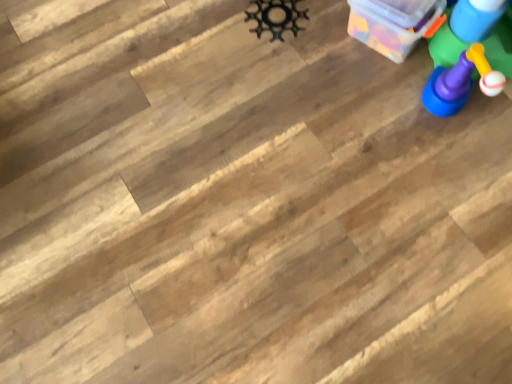
Question: Could you tell me if black metal gear at upper center, which is counted as the 1th toy, starting from the left, is facing transparent plastic container at upper right?

Choices:
 (A) yes
 (B) no

Answer: (B)

Question: Does black metal gear at upper center, the third toy from the right, appear on the left side of transparent plastic container at upper right?

Choices:
 (A) yes
 (B) no

Answer: (A)

Question: Is black metal gear at upper center, which is counted as the 1th toy, starting from the left, located outside transparent plastic container at upper right?

Choices:
 (A) no
 (B) yes

Answer: (B)

Question: From a real-world perspective, is black metal gear at upper center, the third toy from the right, located beneath transparent plastic container at upper right?

Choices:
 (A) no
 (B) yes

Answer: (B)

Question: Is black metal gear at upper center, the third toy from the right, directly adjacent to transparent plastic container at upper right?

Choices:
 (A) no
 (B) yes

Answer: (A)

Question: Is blue plastic toy at upper right, marked as the first toy in a right-to-left arrangement, wider or thinner than matte plastic toy at right, placed as the second toy when sorted from left to right?

Choices:
 (A) wide
 (B) thin

Answer: (B)

Question: From a real-world perspective, is blue plastic toy at upper right, marked as the first toy in a right-to-left arrangement, positioned above or below matte plastic toy at right, placed as the second toy when sorted from left to right?

Choices:
 (A) above
 (B) below

Answer: (B)

Question: In the image, is blue plastic toy at upper right, marked as the first toy in a right-to-left arrangement, positioned in front of or behind matte plastic toy at right, placed as the second toy when sorted from left to right?

Choices:
 (A) behind
 (B) front

Answer: (A)

Question: Considering the positions of blue plastic toy at upper right, the third toy when ordered from left to right, and matte plastic toy at right, placed as the second toy when sorted from left to right, in the image, is blue plastic toy at upper right, the third toy when ordered from left to right, bigger or smaller than matte plastic toy at right, placed as the second toy when sorted from left to right,?

Choices:
 (A) small
 (B) big

Answer: (A)

Question: From a real-world perspective, is blue plastic toy at upper right, marked as the first toy in a right-to-left arrangement, physically located above or below black metal gear at upper center, which is counted as the 1th toy, starting from the left?

Choices:
 (A) below
 (B) above

Answer: (B)

Question: From the image's perspective, is blue plastic toy at upper right, marked as the first toy in a right-to-left arrangement, positioned above or below black metal gear at upper center, the third toy from the right?

Choices:
 (A) above
 (B) below

Answer: (A)

Question: Do you think blue plastic toy at upper right, the third toy when ordered from left to right, is within black metal gear at upper center, the third toy from the right, or outside of it?

Choices:
 (A) outside
 (B) inside

Answer: (A)

Question: In terms of width, does blue plastic toy at upper right, the third toy when ordered from left to right, look wider or thinner when compared to black metal gear at upper center, the third toy from the right?

Choices:
 (A) thin
 (B) wide

Answer: (A)

Question: Based on their positions, is matte plastic toy at right, which is the 2th toy in right-to-left order, located to the left or right of black metal gear at upper center, which is counted as the 1th toy, starting from the left?

Choices:
 (A) left
 (B) right

Answer: (B)

Question: Looking at the image, does matte plastic toy at right, which is the 2th toy in right-to-left order, seem bigger or smaller compared to black metal gear at upper center, which is counted as the 1th toy, starting from the left?

Choices:
 (A) big
 (B) small

Answer: (A)